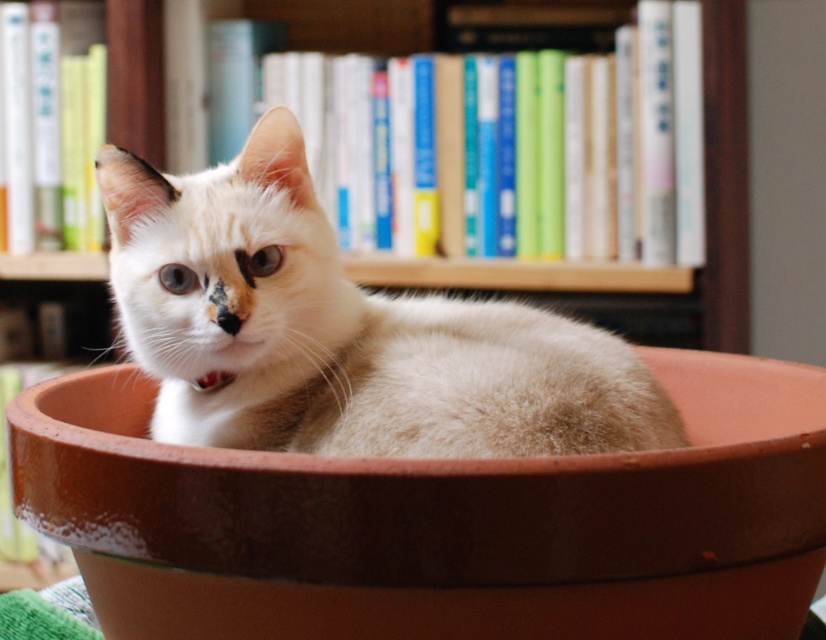
You are a photographer trying to capture a closeup of the soft white fur cat at center. However, the terracotta clay bowl at center is blocking your view. Can you move the bowl to the left to get a better shot?

The terracotta clay bowl at center is currently to the right of the soft white fur cat at center. Moving it to the left would allow you to see the cat without obstruction.

You are trying to determine if the soft white fur cat at center can fit entirely inside the terracotta clay bowl at center. Based on the provided information, can the cat fit inside the bowl?

The terracotta clay bowl at center might be wider than the soft white fur cat at center, so there is a possibility that the cat can fit inside the bowl. However, without exact measurements, we cannot be certain.